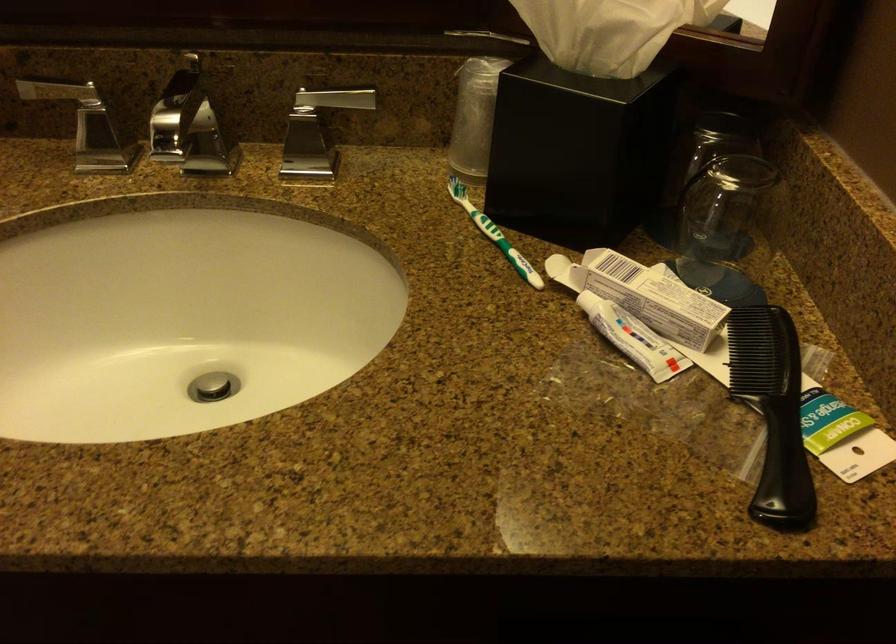
What do you see at coordinates (212, 386) in the screenshot? This screenshot has width=896, height=644. I see `a sink drain stopper` at bounding box center [212, 386].